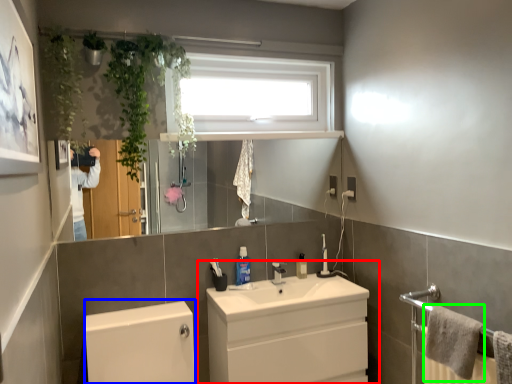
Question: Which is nearer to the bathroom cabinet (highlighted by a red box)? bath (highlighted by a blue box) or bath towel (highlighted by a green box).

Choices:
 (A) bath
 (B) bath towel

Answer: (A)